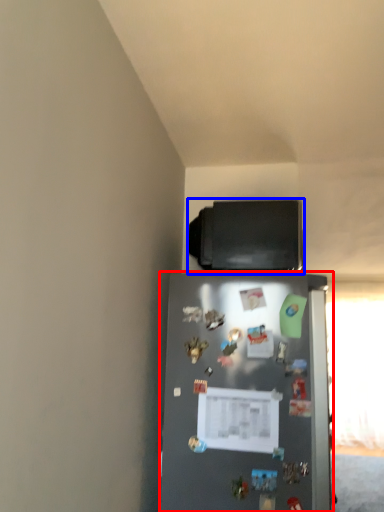
Question: Which of the following is the closest to the observer, refrigerator (highlighted by a red box) or appliance (highlighted by a blue box)?

Choices:
 (A) refrigerator
 (B) appliance

Answer: (A)